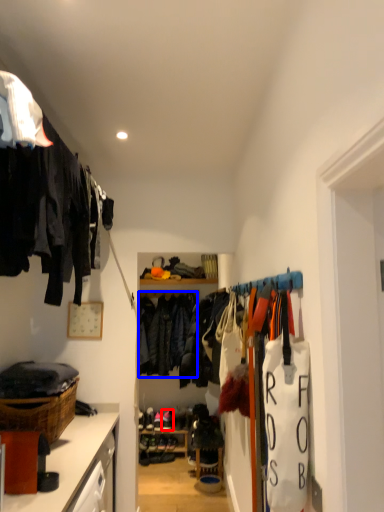
Question: Which object appears farthest to the camera in this image, footwear (highlighted by a red box) or clothing (highlighted by a blue box)?

Choices:
 (A) footwear
 (B) clothing

Answer: (A)